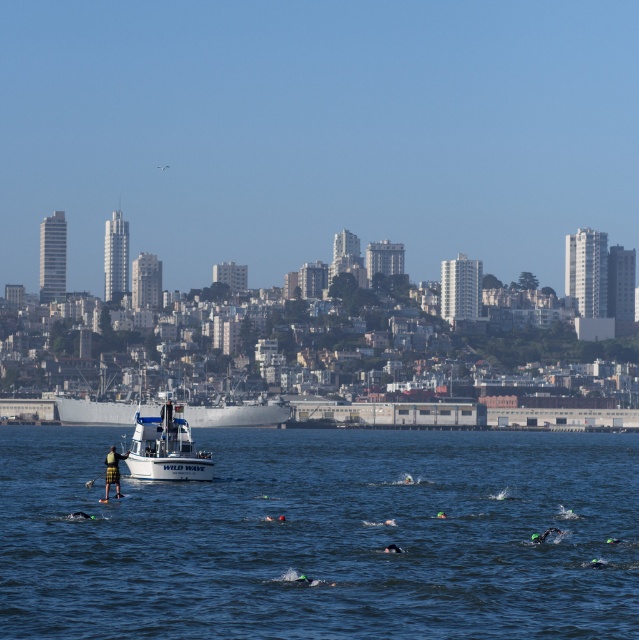
You are a participant in the swim event and need to reach the finish line located at the white matte boat at center. Given that you can swim at a pace of 2 meters per second, how many seconds will it take you to reach the boat?

The white matte boat at center is 150.19 meters away from camera. At a swimming pace of 2 meters per second, it would take approximately 75.095 seconds to reach the boat.

You are a swimmer in the bay and need to decide whether to move toward the white matte boat at center or the green kilt at center to get assistance. Based on their sizes, which one would be easier to spot from a distance?

The white matte boat at center is larger in size compared to the green kilt at center, so it would be easier to spot from a distance.